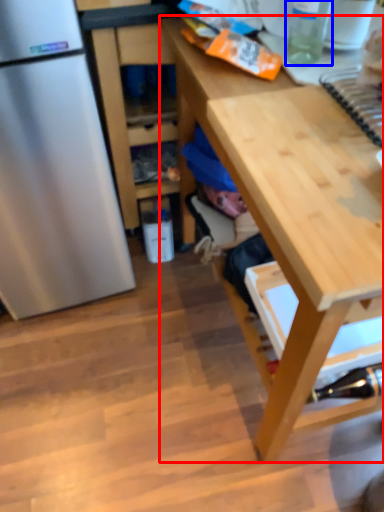
Question: Which object appears farthest to the camera in this image, desk (highlighted by a red box) or bottle (highlighted by a blue box)?

Choices:
 (A) desk
 (B) bottle

Answer: (B)